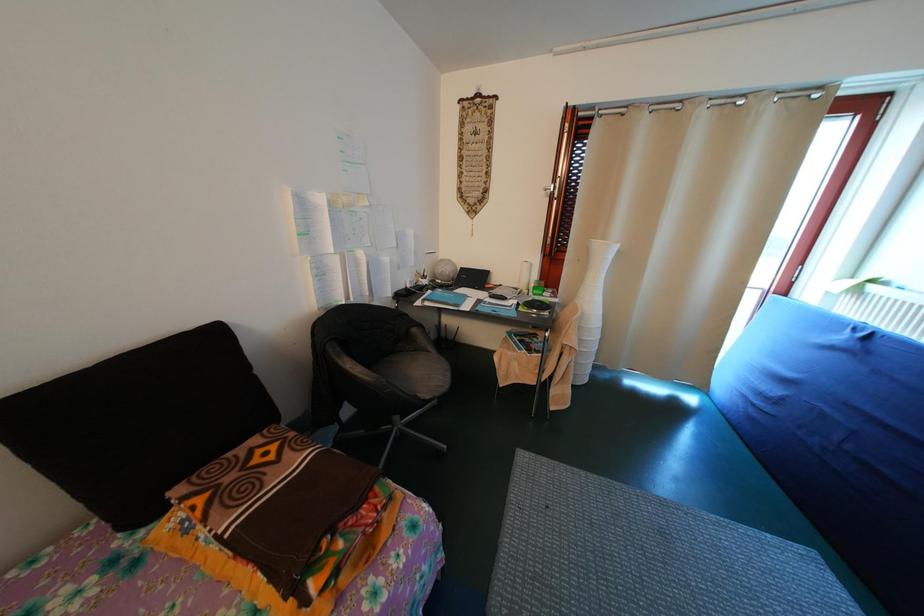
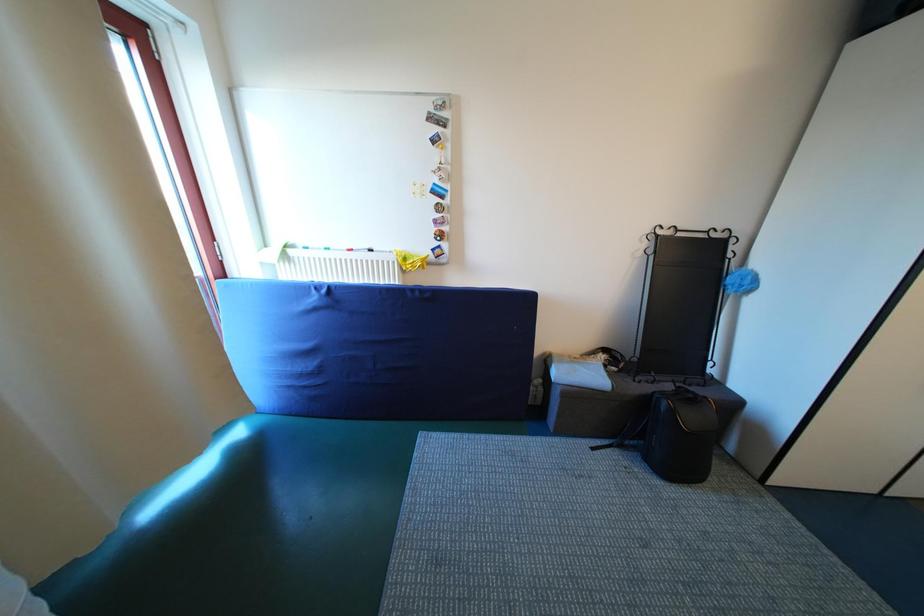
The first image is from the beginning of the video and the second image is from the end. How did the camera likely rotate when shooting the video?

The camera's rotation is toward right-down.